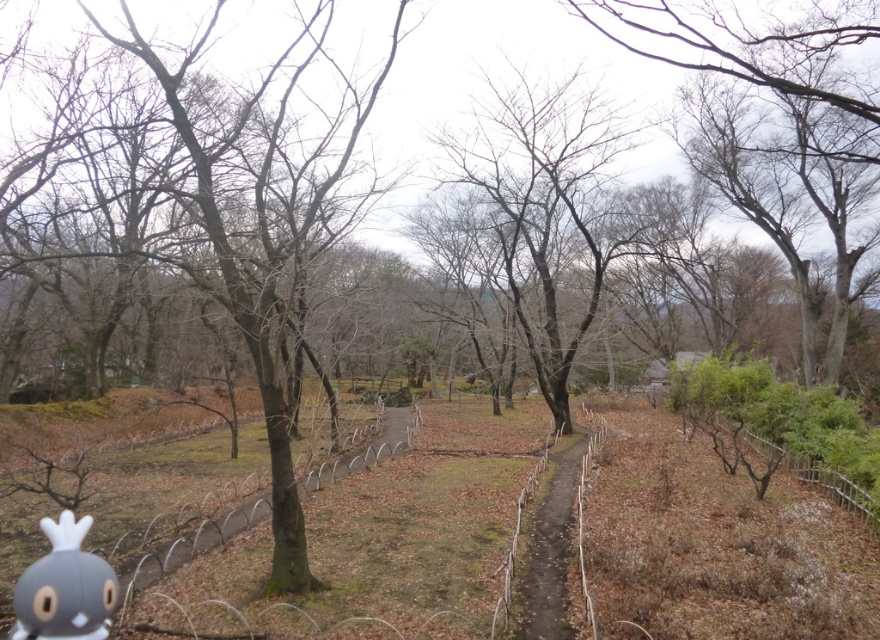
Question: Can you confirm if bare branches at center is bigger than matte gray plush toy at lower left?

Choices:
 (A) yes
 (B) no

Answer: (A)

Question: Which point appears closest to the camera in this image?

Choices:
 (A) (35, 634)
 (B) (809, 52)

Answer: (A)

Question: Does brown rough bark tree at center appear on the right side of brown dirt path at center?

Choices:
 (A) no
 (B) yes

Answer: (A)

Question: Which object is closer to the camera taking this photo?

Choices:
 (A) matte gray plush toy at lower left
 (B) bare branches at upper right
 (C) brown rough bark tree at center

Answer: (A)

Question: Which object is closer to the camera taking this photo?

Choices:
 (A) matte gray plush toy at lower left
 (B) bare branches at upper right
 (C) brown dirt path at center
 (D) brown rough bark tree at center

Answer: (A)

Question: Does brown rough bark tree at center appear over brown dirt path at center?

Choices:
 (A) no
 (B) yes

Answer: (B)